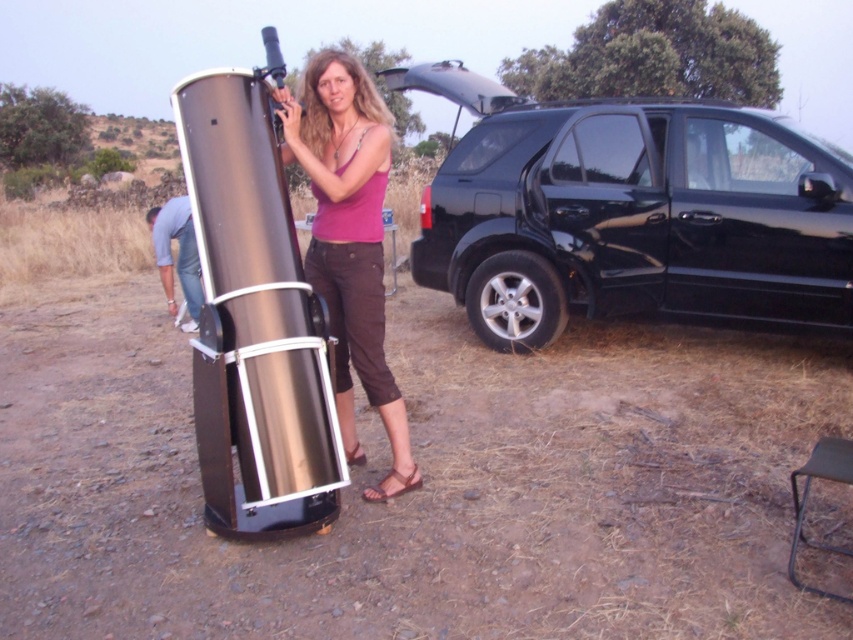
Question: Which point is closer to the camera?

Choices:
 (A) (187, 272)
 (B) (323, 248)
 (C) (775, 113)

Answer: (B)

Question: Which object is the closest to the black glossy suv at right?

Choices:
 (A) brushed metal shoe at lower left
 (B) matte pink tank top at center

Answer: (B)

Question: Is black glossy suv at right positioned in front of brushed metal shoe at lower left?

Choices:
 (A) no
 (B) yes

Answer: (B)

Question: Which of these objects is positioned farthest from the matte pink tank top at center?

Choices:
 (A) black glossy suv at right
 (B) brushed metal shoe at lower left

Answer: (B)

Question: Is matte pink tank top at center positioned at the back of brushed metal shoe at lower left?

Choices:
 (A) no
 (B) yes

Answer: (A)

Question: Is matte pink tank top at center to the right of brushed metal shoe at lower left from the viewer's perspective?

Choices:
 (A) no
 (B) yes

Answer: (B)